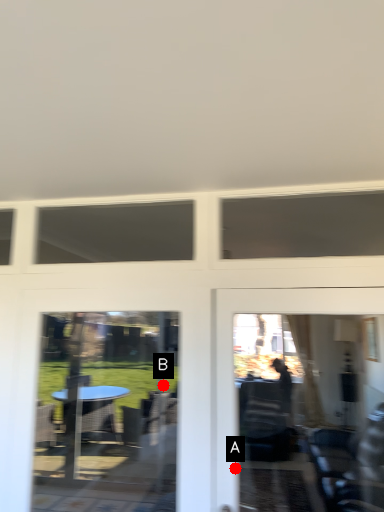
Question: Two points are circled on the image, labeled by A and B beside each circle. Which point is closer to the camera taking this photo?

Choices:
 (A) A is closer
 (B) B is closer

Answer: (A)